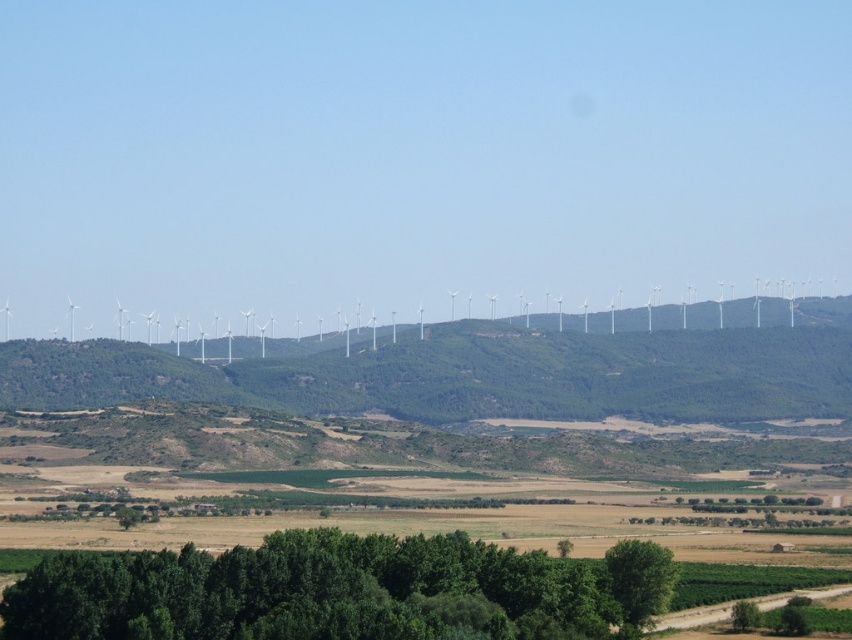
Question: Can you confirm if green leafy trees at lower center is wider than white plastic wind turbines at center?

Choices:
 (A) no
 (B) yes

Answer: (A)

Question: Is green leafy trees at lower center to the right of green leafy tree at lower center from the viewer's perspective?

Choices:
 (A) yes
 (B) no

Answer: (B)

Question: Which point is closer to the camera?

Choices:
 (A) white plastic wind turbines at center
 (B) green leafy tree at lower center
 (C) green leafy trees at lower center

Answer: (C)

Question: Is green leafy trees at lower center to the left of white plastic wind turbines at center from the viewer's perspective?

Choices:
 (A) yes
 (B) no

Answer: (A)

Question: Which of the following is the farthest from the observer?

Choices:
 (A) (636, 564)
 (B) (452, 554)

Answer: (A)

Question: Which point is farther from the camera taking this photo?

Choices:
 (A) (392, 570)
 (B) (649, 564)
 (C) (755, 301)

Answer: (C)